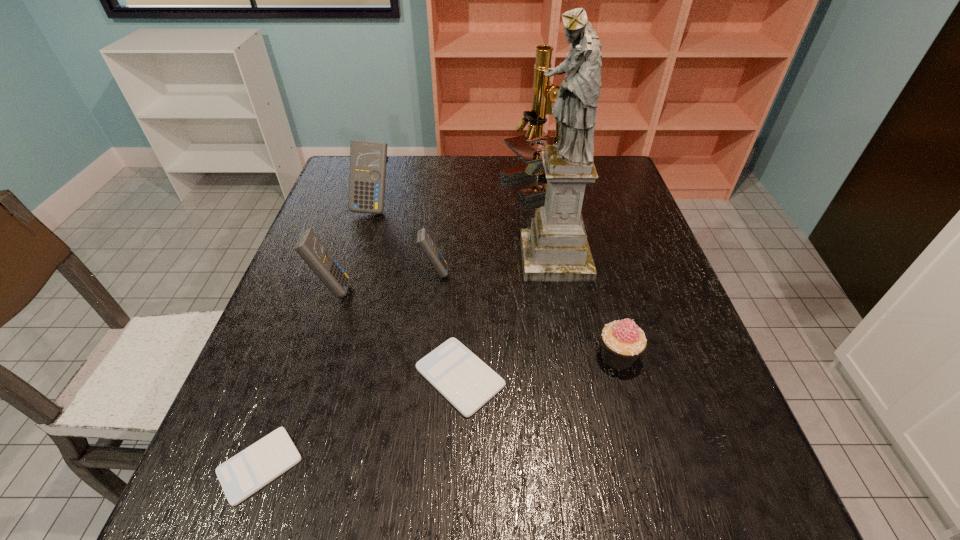
Where is `free point located 0.140m at the eyepiece of the microscope`? free point located 0.140m at the eyepiece of the microscope is located at coordinates (455, 185).

Where is `free space located 0.140m on the front-facing side of the tallest calculator`? This screenshot has height=540, width=960. free space located 0.140m on the front-facing side of the tallest calculator is located at coordinates (360, 252).

You are a GUI agent. You are given a task and a screenshot of the screen. Output one action in this format:
    pyautogui.click(x=<x>, y=<y>)
    Task: Click on the vacant space located on the front-facing side of the second tallest calculator
    
    Given the screenshot: What is the action you would take?
    pyautogui.click(x=468, y=289)

Where is `vacant region located 0.230m on the front-facing side of the rightmost blue calculator`? This screenshot has width=960, height=540. vacant region located 0.230m on the front-facing side of the rightmost blue calculator is located at coordinates (543, 272).

At what (x,y) coordinates should I click in order to perform the action: click on vacant space located on the back of the pink cupcake. Please return your answer as a coordinate pair (x, y). Looking at the image, I should click on (599, 288).

What are the coordinates of `vacant space located on the left of the second shortest object` in the screenshot? It's located at (369, 377).

Find the location of a particular element. The image size is (960, 540). free space located 0.140m on the right of the left white calculator is located at coordinates (384, 465).

The image size is (960, 540). What are the coordinates of `microscope located in the far edge section of the desktop` in the screenshot? It's located at (544, 92).

The image size is (960, 540). Find the location of `calculator located in the far edge section of the desktop`. calculator located in the far edge section of the desktop is located at coordinates point(367,176).

The height and width of the screenshot is (540, 960). Find the location of `object that is at the near edge`. object that is at the near edge is located at coordinates (244, 474).